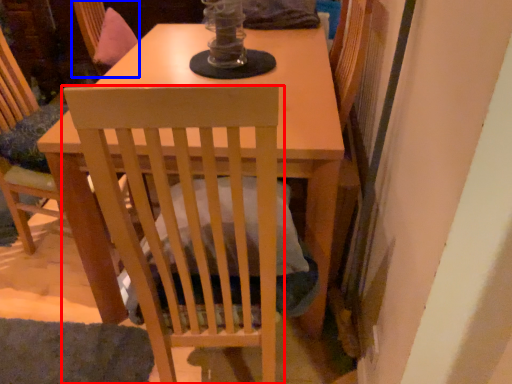
Question: Among these objects, which one is farthest to the camera, chair (highlighted by a red box) or swivel chair (highlighted by a blue box)?

Choices:
 (A) chair
 (B) swivel chair

Answer: (B)